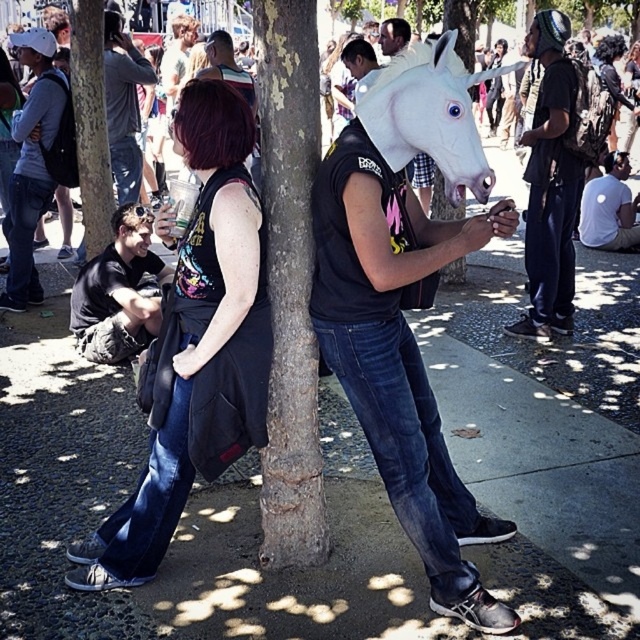
You are trying to decide whether to lean against the brown rough bark tree at center or the matte black hair at lower left. Which object is larger in size?

The brown rough bark tree at center is bigger than the matte black hair at lower left, so you should choose the brown rough bark tree at center as it is larger.